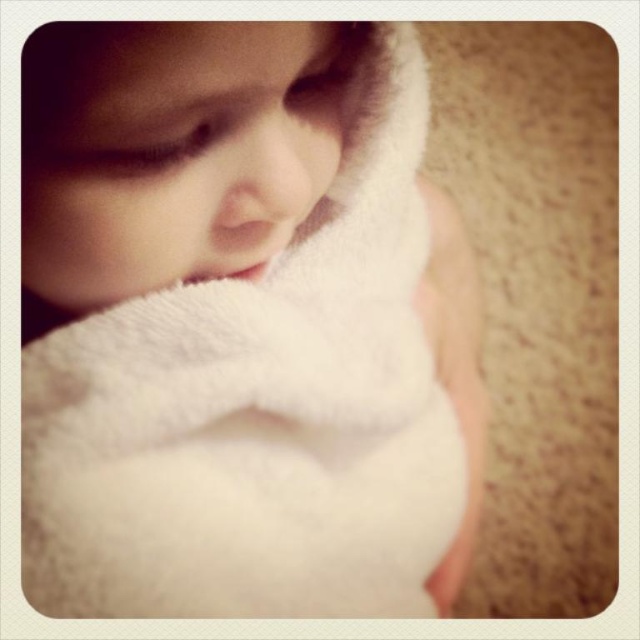
Question: Is white fluffy towel at upper left thinner than white fluffy towel at center?

Choices:
 (A) yes
 (B) no

Answer: (B)

Question: Is white fluffy towel at upper left to the right of white fluffy towel at center from the viewer's perspective?

Choices:
 (A) no
 (B) yes

Answer: (B)

Question: Can you confirm if white fluffy towel at upper left is wider than white fluffy towel at center?

Choices:
 (A) no
 (B) yes

Answer: (B)